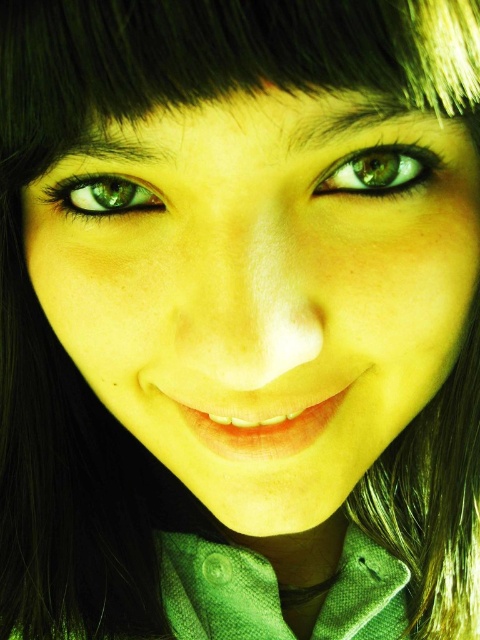
Does green matte eye at upper center come in front of green matte eye at upper left?

Yes, green matte eye at upper center is in front of green matte eye at upper left.

Between green matte eye at upper center and green matte eye at upper left, which one is positioned lower?

green matte eye at upper left is lower down.

Between point (385, 150) and point (62, 195), which one is positioned behind?

Point (62, 195)

At what (x,y) coordinates should I click in order to perform the action: click on green matte eye at upper center. Please return your answer as a coordinate pair (x, y). This screenshot has height=640, width=480. Looking at the image, I should click on (379, 170).

Is green textured dress shirt at center wider than green matte eye at upper left?

Yes, green textured dress shirt at center is wider than green matte eye at upper left.

Where is `green textured dress shirt at center`? The height and width of the screenshot is (640, 480). green textured dress shirt at center is located at coordinates (218, 589).

Where is `green textured dress shirt at center`? This screenshot has width=480, height=640. green textured dress shirt at center is located at coordinates (218, 589).

Is green matte face at center bigger than green textured dress shirt at center?

Indeed, green matte face at center has a larger size compared to green textured dress shirt at center.

Does green matte face at center have a lesser height compared to green textured dress shirt at center?

In fact, green matte face at center may be taller than green textured dress shirt at center.

This screenshot has height=640, width=480. What are the coordinates of `green matte face at center` in the screenshot? It's located at (262, 292).

This screenshot has height=640, width=480. What are the coordinates of `green matte face at center` in the screenshot? It's located at (262, 292).